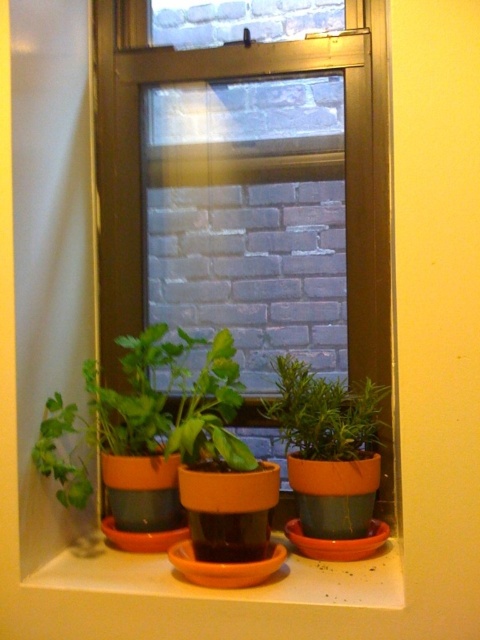
Question: Can you confirm if metallic brown window frame at center is positioned below orange clay pot at lower center?

Choices:
 (A) yes
 (B) no

Answer: (B)

Question: Which object is positioned farthest from the orange clay pot at lower center?

Choices:
 (A) metallic brown window frame at center
 (B) matte orange pot at left

Answer: (A)

Question: Which object is the farthest from the matte orange pot at left?

Choices:
 (A) metallic brown window frame at center
 (B) green matte plant at center

Answer: (A)

Question: Considering the real-world distances, which object is farthest from the matte orange pot at left?

Choices:
 (A) metallic brown window frame at center
 (B) orange clay pot at lower center
 (C) green matte plant at center

Answer: (B)

Question: Is orange clay pot at lower center wider than green matte plant at center?

Choices:
 (A) no
 (B) yes

Answer: (B)

Question: Does metallic brown window frame at center have a larger size compared to green matte plant at center?

Choices:
 (A) yes
 (B) no

Answer: (A)